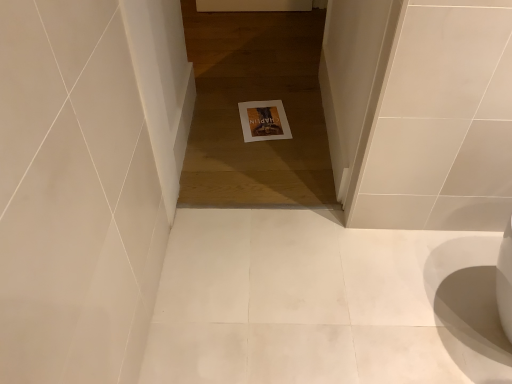
Question: Should I look upward or downward to see white paper at center?

Choices:
 (A) down
 (B) up

Answer: (B)

Question: Can you confirm if white paper at center is taller than white paper at center?

Choices:
 (A) yes
 (B) no

Answer: (A)

Question: Is white paper at center oriented towards white paper at center?

Choices:
 (A) yes
 (B) no

Answer: (A)

Question: Is white paper at center positioned with its back to white paper at center?

Choices:
 (A) yes
 (B) no

Answer: (B)

Question: From the image's perspective, is white paper at center located above white paper at center?

Choices:
 (A) yes
 (B) no

Answer: (A)

Question: Is white paper at center completely or partially inside white paper at center?

Choices:
 (A) yes
 (B) no

Answer: (A)

Question: From a real-world perspective, is white paper at center physically above white paper at center?

Choices:
 (A) yes
 (B) no

Answer: (A)

Question: From the image's perspective, is white paper at center over white paper at center?

Choices:
 (A) yes
 (B) no

Answer: (B)

Question: Is the depth of white paper at center greater than that of white paper at center?

Choices:
 (A) yes
 (B) no

Answer: (A)

Question: Could you tell me if white paper at center is turned towards white paper at center?

Choices:
 (A) yes
 (B) no

Answer: (A)

Question: Is white paper at center not within white paper at center?

Choices:
 (A) no
 (B) yes

Answer: (A)

Question: Considering the relative sizes of white paper at center and white paper at center in the image provided, is white paper at center wider than white paper at center?

Choices:
 (A) no
 (B) yes

Answer: (A)

Question: Is the position of white paper at center less distant than that of white paper at center?

Choices:
 (A) no
 (B) yes

Answer: (A)

Question: Is white paper at center inside the boundaries of white paper at center, or outside?

Choices:
 (A) outside
 (B) inside

Answer: (A)